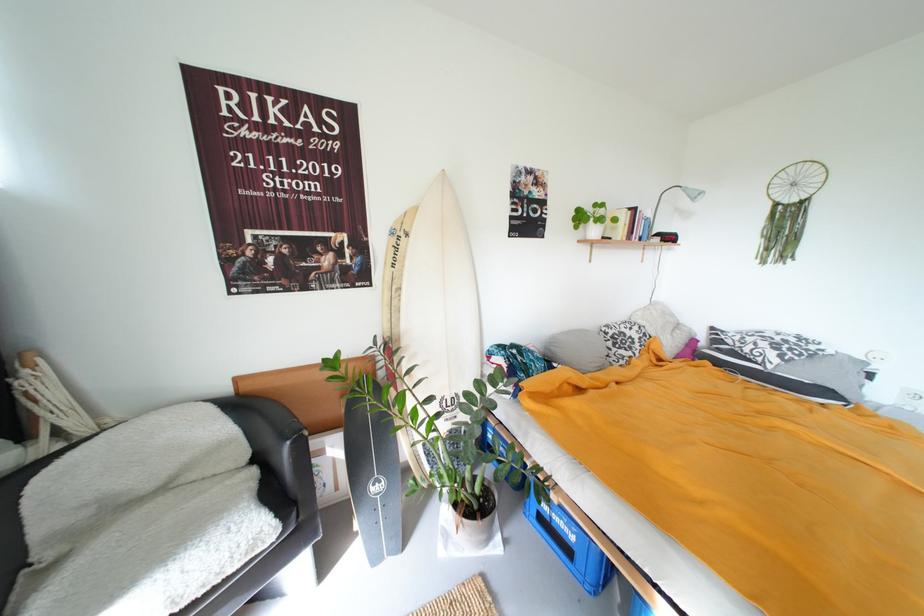
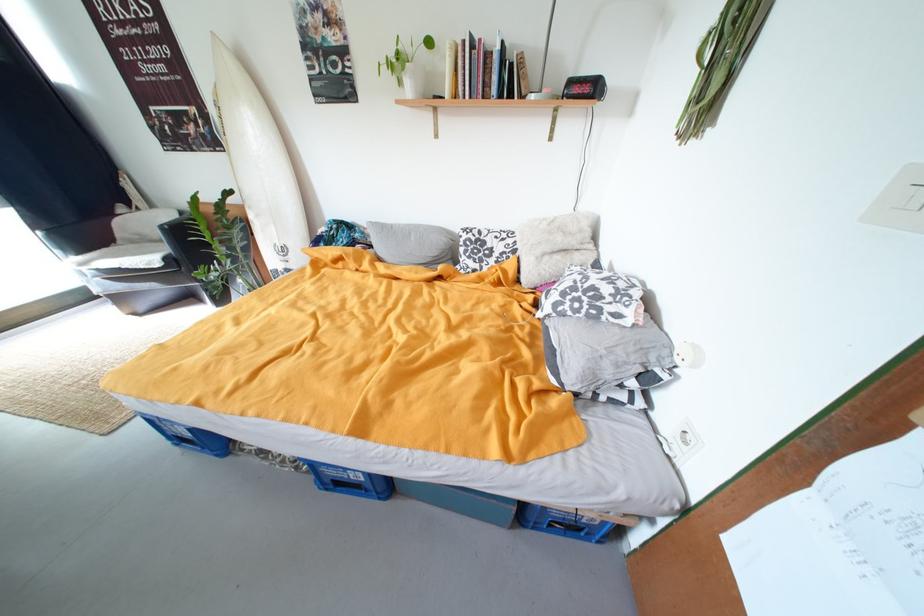
Locate, in the second image, the point that corresponds to the point at 407,237 in the first image.

(225, 108)